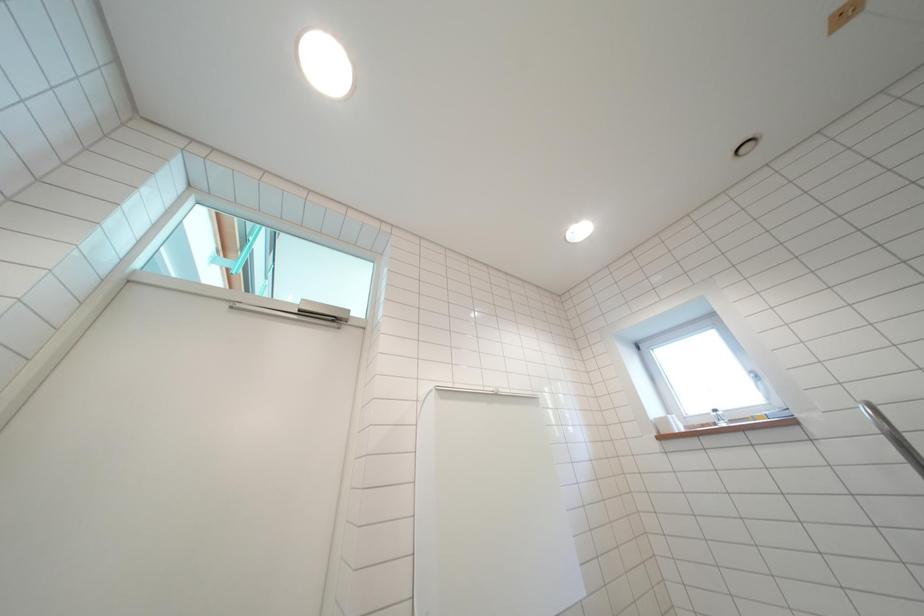
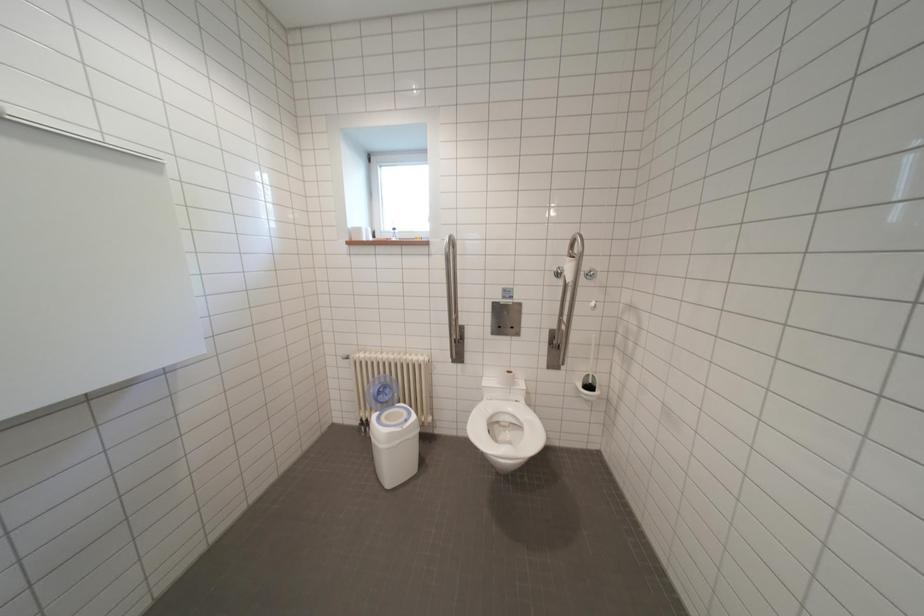
First-person continuous shooting, in which direction is the camera rotating?

The camera rotated toward right-down.